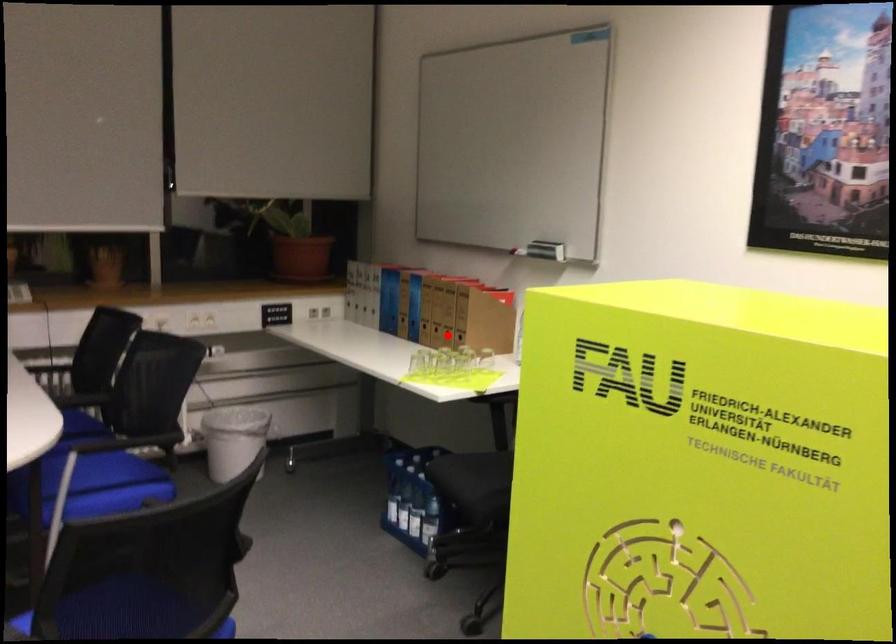
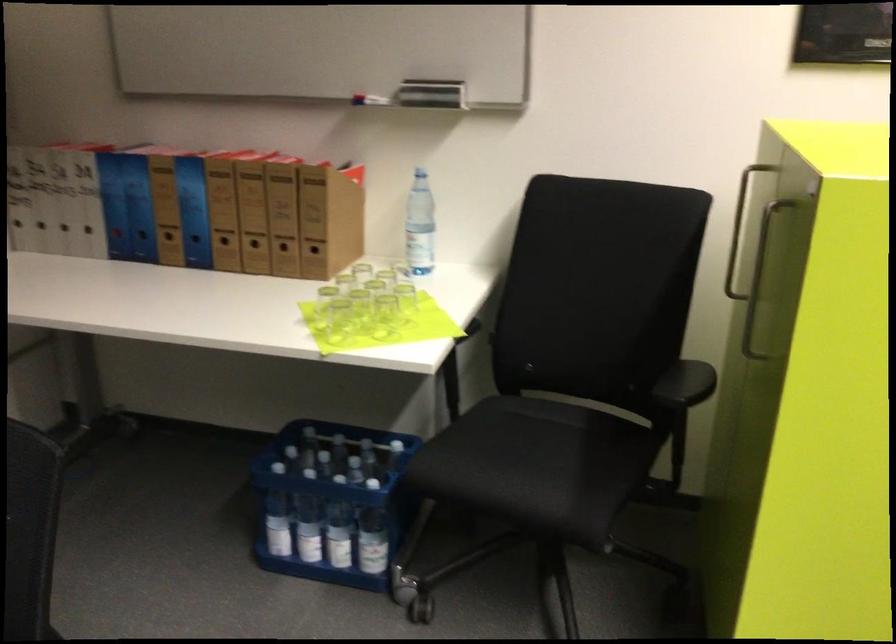
The point at the highlighted location is marked in the first image. Where is the corresponding point in the second image?

(283, 252)